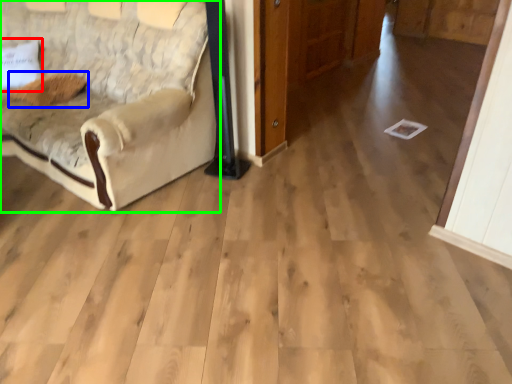
Question: Considering the real-world distances, which object is farthest from pillow (highlighted by a red box)? pillow (highlighted by a blue box) or studio couch (highlighted by a green box)?

Choices:
 (A) pillow
 (B) studio couch

Answer: (B)